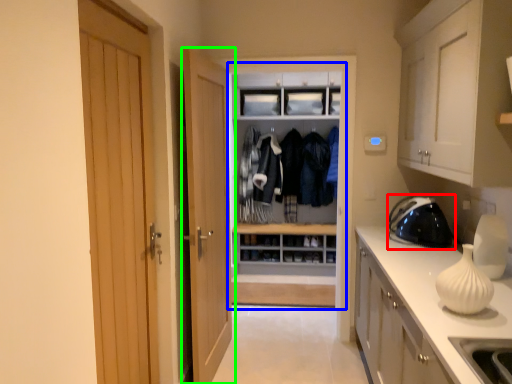
Question: Considering the real-world distances, which object is farthest from appliance (highlighted by a red box)? dresser (highlighted by a blue box) or door (highlighted by a green box)?

Choices:
 (A) dresser
 (B) door

Answer: (B)